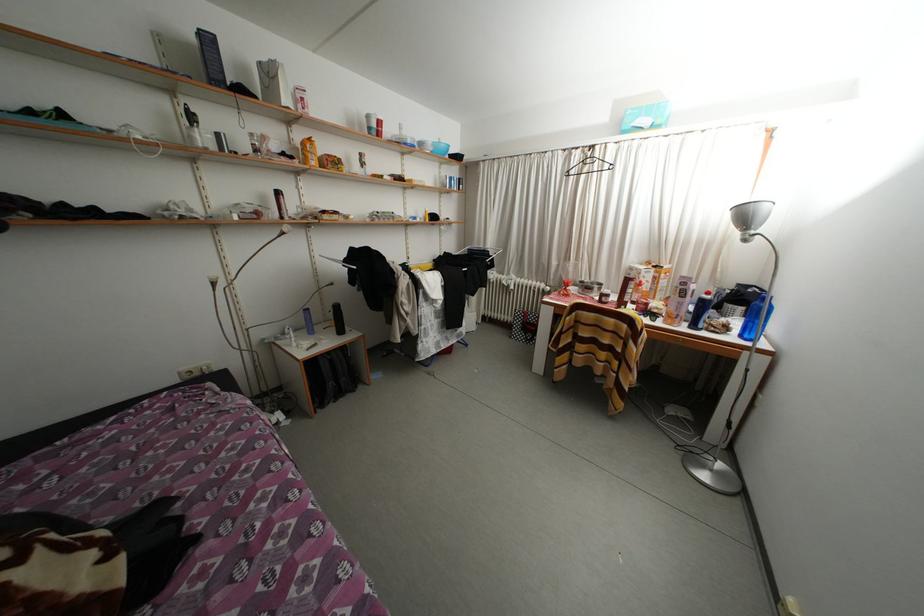
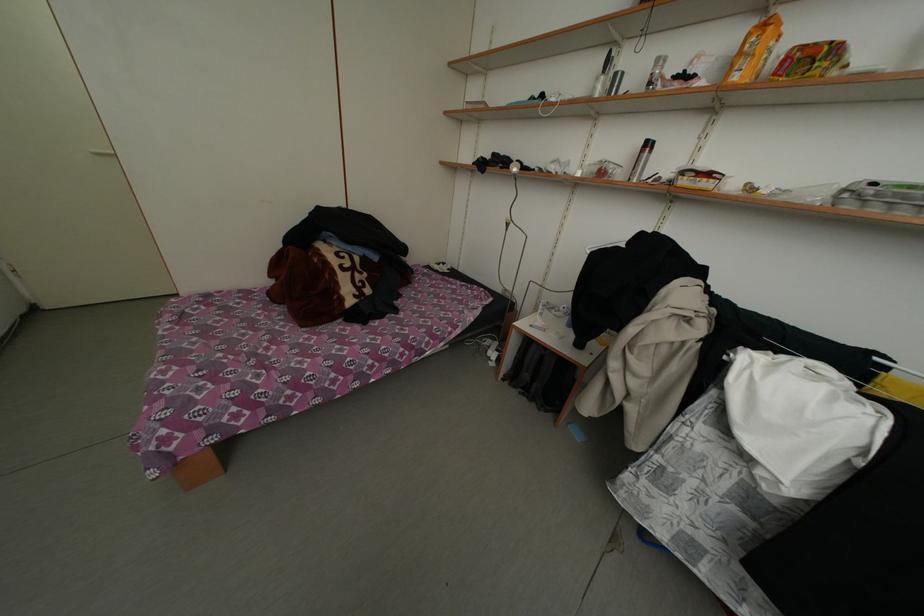
Locate, in the second image, the point that corresponds to the point at 199,143 in the first image.

(602, 94)